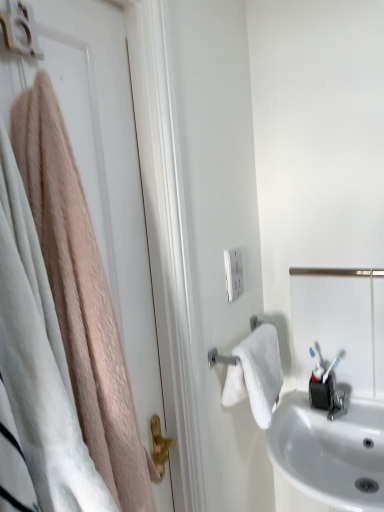
Question: Would you say white matte door at left contains white plastic outlet at center?

Choices:
 (A) no
 (B) yes

Answer: (A)

Question: Is white matte door at left thinner than white plastic outlet at center?

Choices:
 (A) yes
 (B) no

Answer: (B)

Question: Is white matte door at left positioned before white plastic outlet at center?

Choices:
 (A) yes
 (B) no

Answer: (A)

Question: Are white matte door at left and white plastic outlet at center making contact?

Choices:
 (A) no
 (B) yes

Answer: (A)

Question: Considering the relative sizes of white matte door at left and white plastic outlet at center in the image provided, is white matte door at left wider than white plastic outlet at center?

Choices:
 (A) yes
 (B) no

Answer: (A)

Question: Can you confirm if white matte door at left is shorter than white plastic outlet at center?

Choices:
 (A) yes
 (B) no

Answer: (B)

Question: Is satin silver mirror at right smaller than white glossy sink at lower right?

Choices:
 (A) no
 (B) yes

Answer: (B)

Question: Could you tell me if satin silver mirror at right is turned towards white glossy sink at lower right?

Choices:
 (A) yes
 (B) no

Answer: (B)

Question: Does satin silver mirror at right appear on the left side of white glossy sink at lower right?

Choices:
 (A) no
 (B) yes

Answer: (A)

Question: Is satin silver mirror at right further to the viewer compared to white glossy sink at lower right?

Choices:
 (A) no
 (B) yes

Answer: (B)

Question: Considering the relative sizes of satin silver mirror at right and white glossy sink at lower right in the image provided, is satin silver mirror at right wider than white glossy sink at lower right?

Choices:
 (A) no
 (B) yes

Answer: (A)

Question: Is white glossy sink at lower right inside satin silver mirror at right?

Choices:
 (A) yes
 (B) no

Answer: (B)

Question: Is white glossy sink at lower right closer to the viewer compared to white plastic outlet at center?

Choices:
 (A) no
 (B) yes

Answer: (B)